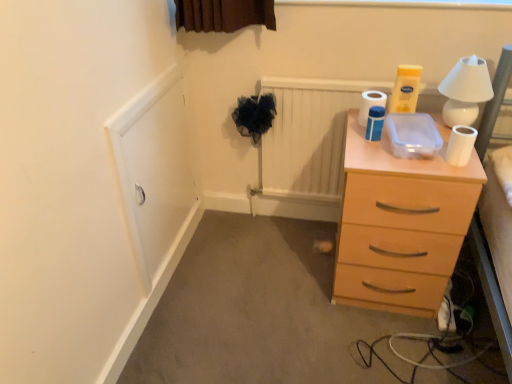
You are a GUI agent. You are given a task and a screenshot of the screen. Output one action in this format:
    pyautogui.click(x=<x>, y=<y>)
    Task: Click on the white ceramic table lamp at upper right
    Image resolution: width=512 pixels, height=384 pixels.
    Given the screenshot: What is the action you would take?
    pyautogui.click(x=465, y=91)

What is the approximate height of light wood chest of drawers at right?

25.93 inches.

What do you see at coordinates (400, 226) in the screenshot? I see `light wood chest of drawers at right` at bounding box center [400, 226].

What do you see at coordinates (370, 104) in the screenshot? I see `white glossy toilet paper at upper right, the 1th toilet paper when ordered from back to front` at bounding box center [370, 104].

Locate an element on the screen. white glossy toilet paper at upper right, the second toilet paper from the left is located at coordinates (370, 104).

Measure the distance between point (454, 128) and camera.

The distance of point (454, 128) from camera is 4.62 feet.

You are a GUI agent. You are given a task and a screenshot of the screen. Output one action in this format:
    pyautogui.click(x=<x>, y=<y>)
    Task: Click on the white ceramic table lamp at upper right
    The image size is (512, 384).
    Given the screenshot: What is the action you would take?
    pyautogui.click(x=465, y=91)

What's the angular difference between white glossy toilet paper at upper right, the second toilet paper from the left, and white matte toilet paper at upper right, positioned as the 1th toilet paper in right-to-left order,'s facing directions?

0.0128 degrees separate the facing orientations of white glossy toilet paper at upper right, the second toilet paper from the left, and white matte toilet paper at upper right, positioned as the 1th toilet paper in right-to-left order.

From the picture: Is there a large distance between white glossy toilet paper at upper right, the 1th toilet paper when ordered from back to front, and white matte toilet paper at upper right, positioned as the 1th toilet paper in right-to-left order?

No, white glossy toilet paper at upper right, the 1th toilet paper when ordered from back to front, is not far away from white matte toilet paper at upper right, positioned as the 1th toilet paper in right-to-left order.

Considering the relative sizes of white glossy toilet paper at upper right, the second toilet paper from the left, and white matte toilet paper at upper right, marked as the third toilet paper in a back-to-front arrangement, in the image provided, is white glossy toilet paper at upper right, the second toilet paper from the left, shorter than white matte toilet paper at upper right, marked as the third toilet paper in a back-to-front arrangement,?

Incorrect, the height of white glossy toilet paper at upper right, the second toilet paper from the left, does not fall short of that of white matte toilet paper at upper right, marked as the third toilet paper in a back-to-front arrangement.

From the image's perspective, is white glossy toilet paper at upper right, acting as the second toilet paper starting from the right, above white matte toilet paper at upper right, marked as the third toilet paper in a back-to-front arrangement?

Correct, white glossy toilet paper at upper right, acting as the second toilet paper starting from the right, appears higher than white matte toilet paper at upper right, marked as the third toilet paper in a back-to-front arrangement, in the image.

Is white matte toilet paper at upper right, which ranks as the third toilet paper in left-to-right order, far from light wood chest of drawers at right?

white matte toilet paper at upper right, which ranks as the third toilet paper in left-to-right order, is near light wood chest of drawers at right, not far away.

Is point (465, 164) farther from viewer compared to point (453, 257)?

No, it is in front of (453, 257).

Based on their sizes in the image, would you say white matte toilet paper at upper right, the first toilet paper viewed from the front, is bigger or smaller than light wood chest of drawers at right?

Clearly, white matte toilet paper at upper right, the first toilet paper viewed from the front, is smaller in size than light wood chest of drawers at right.

Can you see white glossy toilet paper at upper right, the 1th toilet paper when ordered from back to front, touching white matte toilet paper at upper right, arranged as the second toilet paper when viewed from the front?

Yes, white glossy toilet paper at upper right, the 1th toilet paper when ordered from back to front, is touching white matte toilet paper at upper right, arranged as the second toilet paper when viewed from the front.

Between white glossy toilet paper at upper right, which is the third toilet paper in front-to-back order, and white matte toilet paper at upper right, the 2th toilet paper from the back, which one has larger width?

white glossy toilet paper at upper right, which is the third toilet paper in front-to-back order, is wider.

Between white glossy toilet paper at upper right, which is the third toilet paper in front-to-back order, and white matte toilet paper at upper right, the 2th toilet paper from the back, which one has less height?

Standing shorter between the two is white glossy toilet paper at upper right, which is the third toilet paper in front-to-back order.

Would you say white ceramic table lamp at upper right is to the left or to the right of white matte toilet paper at upper right, which ranks as the third toilet paper in left-to-right order, in the picture?

Clearly, white ceramic table lamp at upper right is on the right of white matte toilet paper at upper right, which ranks as the third toilet paper in left-to-right order, in the image.

From a real-world perspective, is white ceramic table lamp at upper right located higher than white matte toilet paper at upper right, the first toilet paper viewed from the front?

Yes, from a real-world perspective, white ceramic table lamp at upper right is on top of white matte toilet paper at upper right, the first toilet paper viewed from the front.

Considering the sizes of objects white ceramic table lamp at upper right and white matte toilet paper at upper right, which ranks as the third toilet paper in left-to-right order, in the image provided, who is bigger, white ceramic table lamp at upper right or white matte toilet paper at upper right, which ranks as the third toilet paper in left-to-right order,?

With larger size is white ceramic table lamp at upper right.

Is white glossy toilet paper at upper right, the second toilet paper from the left, inside the boundaries of light wood chest of drawers at right, or outside?

white glossy toilet paper at upper right, the second toilet paper from the left, is not enclosed by light wood chest of drawers at right.

Can you confirm if white glossy toilet paper at upper right, the 1th toilet paper when ordered from back to front, is positioned to the left of light wood chest of drawers at right?

Yes, white glossy toilet paper at upper right, the 1th toilet paper when ordered from back to front, is to the left of light wood chest of drawers at right.

You are a GUI agent. You are given a task and a screenshot of the screen. Output one action in this format:
    pyautogui.click(x=<x>, y=<y>)
    Task: Click on the toilet paper that is the 3rd one when counting backward from the light wood chest of drawers at right
    This screenshot has height=384, width=512.
    Given the screenshot: What is the action you would take?
    pyautogui.click(x=370, y=104)

Is white glossy toilet paper at upper right, the 1th toilet paper when ordered from back to front, oriented away from light wood chest of drawers at right?

No, light wood chest of drawers at right is not at the back of white glossy toilet paper at upper right, the 1th toilet paper when ordered from back to front.

From the image's perspective, relative to white ceramic table lamp at upper right, is white matte toilet paper at upper right, which ranks as the third toilet paper in left-to-right order, above or below?

Based on their image positions, white matte toilet paper at upper right, which ranks as the third toilet paper in left-to-right order, is located beneath white ceramic table lamp at upper right.

From a real-world perspective, does white matte toilet paper at upper right, the first toilet paper viewed from the front, sit lower than white ceramic table lamp at upper right?

Yes, from a real-world perspective, white matte toilet paper at upper right, the first toilet paper viewed from the front, is below white ceramic table lamp at upper right.

Does point (449, 145) appear closer or farther from the camera than point (450, 105)?

Point (449, 145) is closer to the camera than point (450, 105).

Relative to white ceramic table lamp at upper right, is white matte toilet paper at upper right, the 2th toilet paper from the back, in front or behind?

white matte toilet paper at upper right, the 2th toilet paper from the back, is positioned farther from the viewer than white ceramic table lamp at upper right.

Between white matte toilet paper at upper right, arranged as the second toilet paper when viewed from the front, and white ceramic table lamp at upper right, which one has smaller size?

white matte toilet paper at upper right, arranged as the second toilet paper when viewed from the front, is smaller.

Looking at this image, from a real-world perspective, which object stands above the other?

white ceramic table lamp at upper right.

From a real-world perspective, which toilet paper is the 1st one above the white matte toilet paper at upper right, positioned as the 1th toilet paper in right-to-left order? Please provide its 2D coordinates.

[(370, 104)]

This screenshot has height=384, width=512. There is a light wood chest of drawers at right. Identify the location of the 1st toilet paper above it (from the image's perspective). (460, 145).

Considering their positions, is light wood chest of drawers at right positioned further to white matte toilet paper at upper right, positioned as the 1th toilet paper in right-to-left order, than white glossy toilet paper at upper right, which is the third toilet paper in front-to-back order?

Among the two, light wood chest of drawers at right is located further to white matte toilet paper at upper right, positioned as the 1th toilet paper in right-to-left order.

Based on their spatial positions, is white matte toilet paper at upper right, arranged as the second toilet paper when viewed from the front, or light wood chest of drawers at right closer to white glossy toilet paper at upper right, acting as the second toilet paper starting from the right?

Based on the image, white matte toilet paper at upper right, arranged as the second toilet paper when viewed from the front, appears to be nearer to white glossy toilet paper at upper right, acting as the second toilet paper starting from the right.

Looking at this image, which object lies nearer to the anchor point white glossy toilet paper at upper right, which is the third toilet paper in front-to-back order, white ceramic table lamp at upper right or light wood chest of drawers at right?

white ceramic table lamp at upper right is closer to white glossy toilet paper at upper right, which is the third toilet paper in front-to-back order.

Considering their positions, is white glossy toilet paper at upper right, which is the third toilet paper in front-to-back order, positioned further to white ceramic table lamp at upper right than white matte toilet paper at upper right, the first toilet paper viewed from the front?

The object further to white ceramic table lamp at upper right is white glossy toilet paper at upper right, which is the third toilet paper in front-to-back order.

Which object lies nearer to the anchor point white ceramic table lamp at upper right, white glossy toilet paper at upper right, the second toilet paper from the left, or white matte toilet paper at upper right, the 2th toilet paper from the back?

Among the two, white matte toilet paper at upper right, the 2th toilet paper from the back, is located nearer to white ceramic table lamp at upper right.

Estimate the real-world distances between objects in this image. Which object is further from white glossy toilet paper at upper right, acting as the second toilet paper starting from the right, white matte toilet paper at upper right, the 2th toilet paper from the back, or white ceramic table lamp at upper right?

The object further to white glossy toilet paper at upper right, acting as the second toilet paper starting from the right, is white ceramic table lamp at upper right.

Based on their spatial positions, is white ceramic table lamp at upper right or white glossy toilet paper at upper right, acting as the second toilet paper starting from the right, closer to white matte toilet paper at upper right, which ranks as the third toilet paper in left-to-right order?

white ceramic table lamp at upper right lies closer to white matte toilet paper at upper right, which ranks as the third toilet paper in left-to-right order, than the other object.

From the image, which object appears to be farther from light wood chest of drawers at right, white ceramic table lamp at upper right or white glossy toilet paper at upper right, the 1th toilet paper when ordered from back to front?

The object further to light wood chest of drawers at right is white glossy toilet paper at upper right, the 1th toilet paper when ordered from back to front.

Where is `toilet paper between white matte toilet paper at upper right, arranged as the second toilet paper when viewed from the front, and white matte toilet paper at upper right, which ranks as the third toilet paper in left-to-right order, from left to right`? This screenshot has width=512, height=384. toilet paper between white matte toilet paper at upper right, arranged as the second toilet paper when viewed from the front, and white matte toilet paper at upper right, which ranks as the third toilet paper in left-to-right order, from left to right is located at coordinates (370, 104).

In order to click on toilet paper between white matte toilet paper at upper right, the third toilet paper in the right-to-left sequence, and light wood chest of drawers at right vertically in this screenshot , I will do `click(460, 145)`.

Where is `toilet paper between white glossy toilet paper at upper right, the 1th toilet paper when ordered from back to front, and white ceramic table lamp at upper right, in the horizontal direction`? This screenshot has height=384, width=512. toilet paper between white glossy toilet paper at upper right, the 1th toilet paper when ordered from back to front, and white ceramic table lamp at upper right, in the horizontal direction is located at coordinates (460, 145).